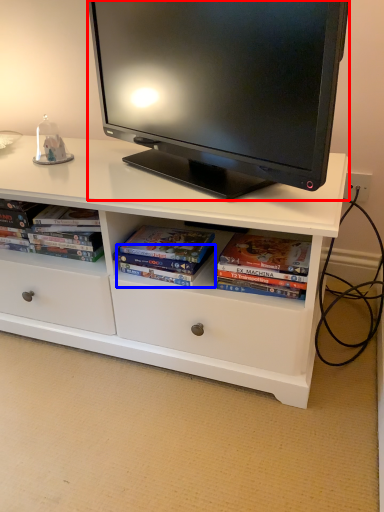
Question: Which of the following is the farthest to the observer, television (highlighted by a red box) or paperback book (highlighted by a blue box)?

Choices:
 (A) television
 (B) paperback book

Answer: (B)